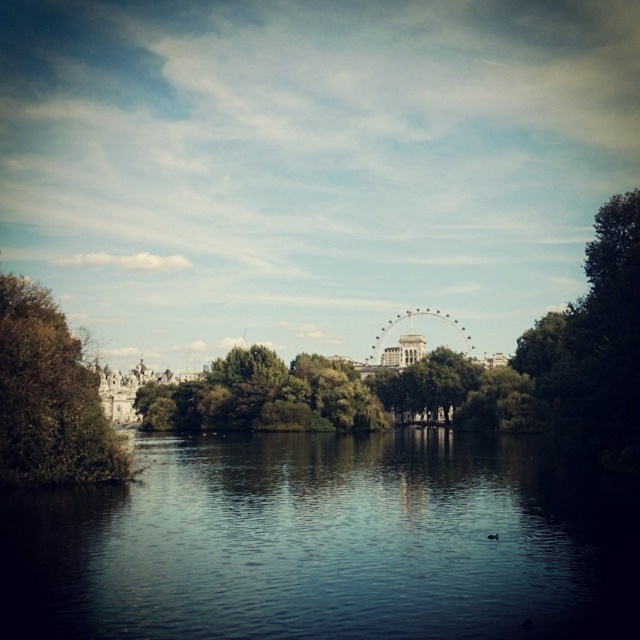
You are standing on the riverside and see the green leafy tree at right and the green leafy tree at left. Which tree is taller?

The green leafy tree at right is taller than the green leafy tree at left according to the description.

You are standing on the riverside path and see the dark reflective water at center and the green leafy tree at left. Which object is closer to your right side?

The dark reflective water at center is closer to your right side because it is positioned to the right of the green leafy tree at left.

You are standing at the riverside and want to take a photo that includes both the dark reflective water at center and the green leafy tree at left. Which object should you focus on first to ensure both are in clear view?

You should focus on the dark reflective water at center first because it is closer to you than the green leafy tree at left, so adjusting focus from near to far will help both be in clear view.